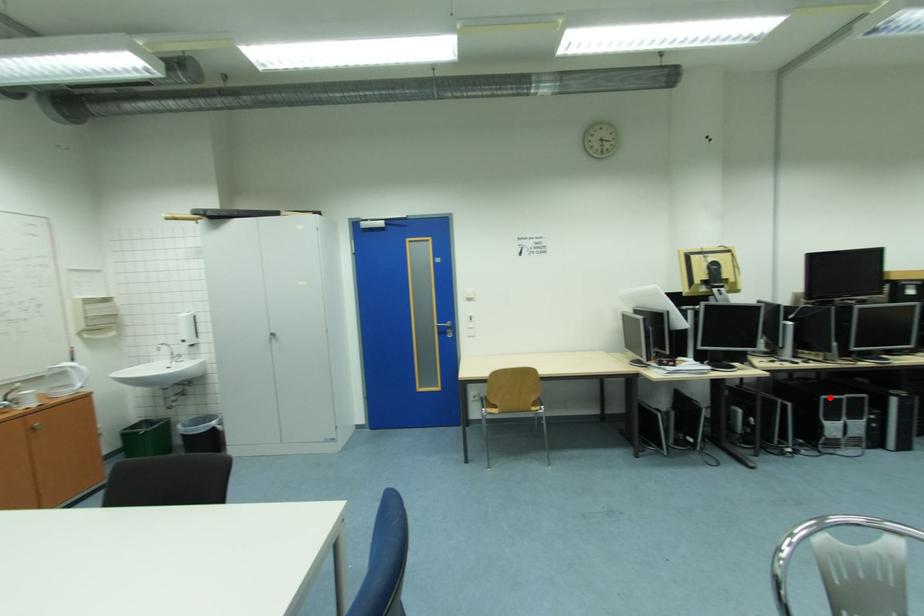
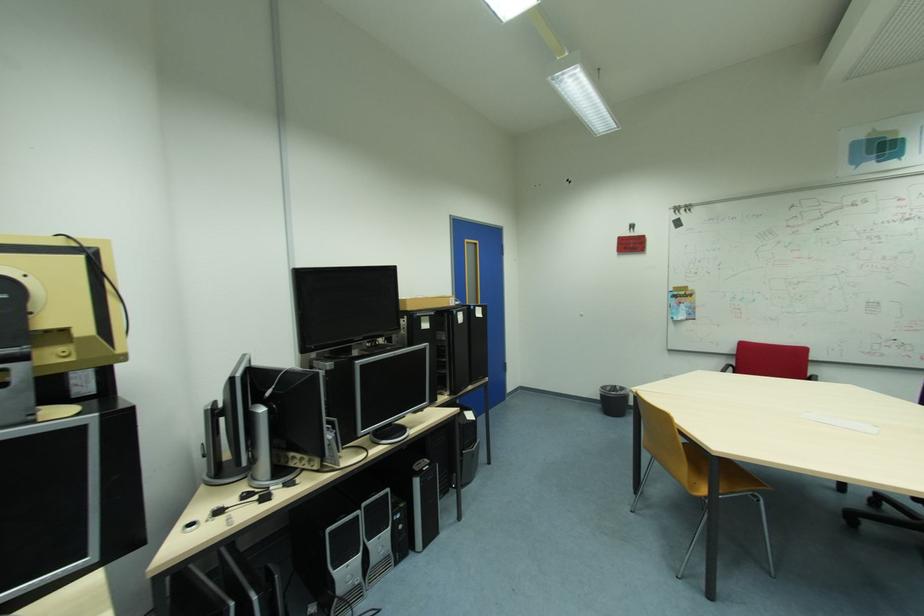
Question: I am providing you with two images of the same scene from different viewpoints. Image1 has a red point marked. In image2, the corresponding 3D location appears at what relative position? Reply with the corresponding letter.

Choices:
 (A) Closer
 (B) Farther

Answer: (B)